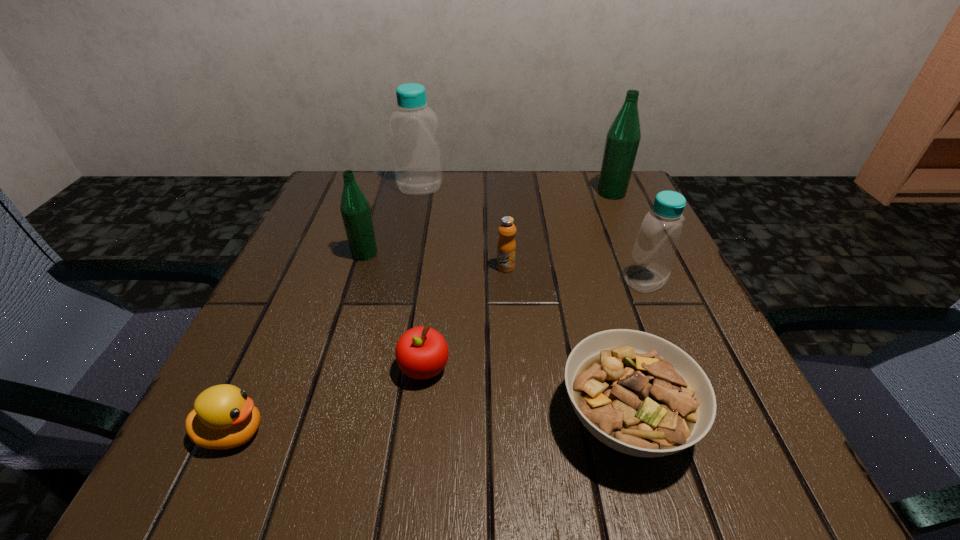
Identify the location of vacant space at the far edge of the desktop. (497, 178).

The width and height of the screenshot is (960, 540). In the image, there is a desktop. In order to click on vacant space at the left edge in this screenshot , I will do `click(328, 291)`.

At what (x,y) coordinates should I click in order to perform the action: click on vacant space at the right edge of the desktop. Please return your answer as a coordinate pair (x, y). The image size is (960, 540). Looking at the image, I should click on (628, 230).

This screenshot has width=960, height=540. Identify the location of blank space at the far left corner. (321, 204).

What are the coordinates of `vacant area at the far right corner of the desktop` in the screenshot? It's located at (578, 192).

What are the coordinates of `free space at the near right corner of the desktop` in the screenshot? It's located at (725, 431).

This screenshot has width=960, height=540. Identify the location of free space that is in between the orange juice and the smaller green bottle. (435, 260).

At what (x,y) coordinates should I click in order to perform the action: click on free space between the duckling and the fifth object from left to right. Please return your answer as a coordinate pair (x, y). The width and height of the screenshot is (960, 540). Looking at the image, I should click on (370, 350).

Where is `vacant area between the right blue bottle and the left blue bottle`? This screenshot has width=960, height=540. vacant area between the right blue bottle and the left blue bottle is located at coordinates (533, 234).

The image size is (960, 540). Find the location of `vacant space in between the farther blue bottle and the apple`. vacant space in between the farther blue bottle and the apple is located at coordinates (422, 278).